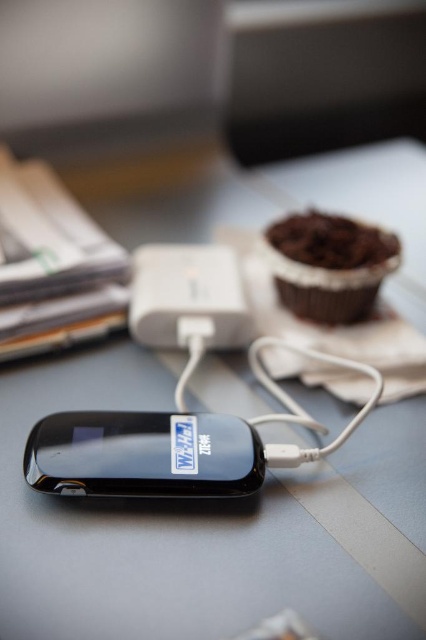
Which is behind, point (60, 419) or point (342, 273)?

Point (342, 273)

Between black glossy smartphone at center and chocolate cake at upper right, which one is positioned lower?

Positioned lower is black glossy smartphone at center.

Locate an element on the screen. The width and height of the screenshot is (426, 640). black glossy smartphone at center is located at coordinates (143, 454).

Can you confirm if chocolate cake at upper right is wider than white plastic power bank at center?

Indeed, chocolate cake at upper right has a greater width compared to white plastic power bank at center.

Which is below, chocolate cake at upper right or white plastic power bank at center?

Positioned lower is white plastic power bank at center.

Between point (273, 225) and point (155, 305), which one is positioned behind?

The point (273, 225) is behind.

This screenshot has width=426, height=640. I want to click on chocolate cake at upper right, so click(328, 264).

Is black glossy smartphone at center thinner than white plastic power bank at center?

No.

Who is more distant from viewer, (258,456) or (213,336)?

Point (213,336)

The height and width of the screenshot is (640, 426). I want to click on black glossy smartphone at center, so click(143, 454).